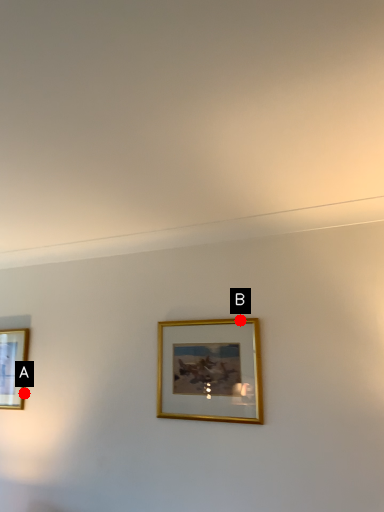
Question: Two points are circled on the image, labeled by A and B beside each circle. Which point is closer to the camera?

Choices:
 (A) A is closer
 (B) B is closer

Answer: (B)